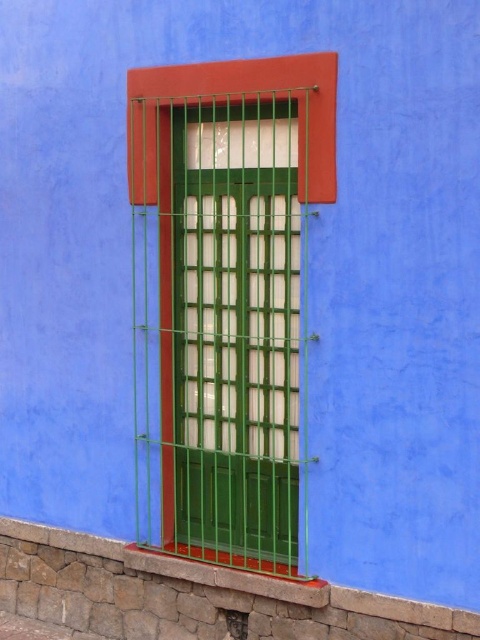
Question: Which point appears farthest from the camera in this image?

Choices:
 (A) (282, 196)
 (B) (176, 604)

Answer: (B)

Question: Which point is closer to the camera taking this photo?

Choices:
 (A) (155, 628)
 (B) (210, 342)

Answer: (B)

Question: Can you confirm if green metallic shutter at center is positioned above stone at lower left?

Choices:
 (A) no
 (B) yes

Answer: (B)

Question: Is green metallic shutter at center bigger than stone at lower left?

Choices:
 (A) yes
 (B) no

Answer: (B)

Question: Where is green metallic shutter at center located in relation to stone at lower left in the image?

Choices:
 (A) right
 (B) left

Answer: (A)

Question: Which of the following is the closest to the observer?

Choices:
 (A) green metallic shutter at center
 (B) stone at lower left

Answer: (B)